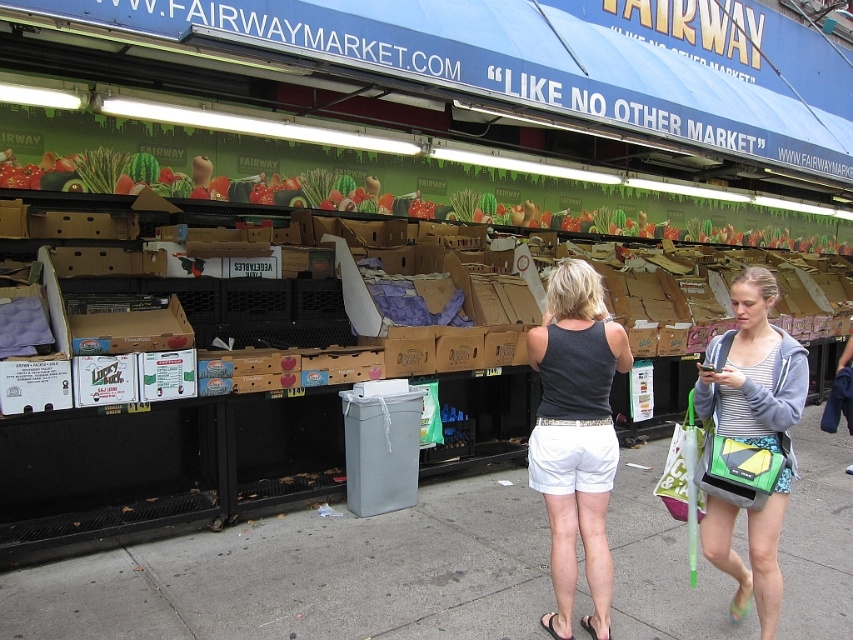
Between point (387, 522) and point (270, 200), which one is positioned in front?

Point (387, 522) is more forward.

Is gray concrete pavement at lower center wider than green leafy vegetables at upper center?

In fact, gray concrete pavement at lower center might be narrower than green leafy vegetables at upper center.

Where is `gray concrete pavement at lower center`? This screenshot has width=853, height=640. gray concrete pavement at lower center is located at coordinates (312, 577).

Looking at this image, is gray concrete pavement at lower center bigger than dark gray tank top at center?

Actually, gray concrete pavement at lower center might be smaller than dark gray tank top at center.

Can you confirm if gray concrete pavement at lower center is shorter than dark gray tank top at center?

Yes.

Between point (326, 628) and point (608, 406), which one is positioned behind?

The point (326, 628) is more distant.

I want to click on gray concrete pavement at lower center, so click(312, 577).

Between point (663, 218) and point (717, 522), which one is positioned behind?

Positioned behind is point (663, 218).

Between point (413, 180) and point (807, 371), which one is positioned in front?

Point (807, 371) is more forward.

This screenshot has width=853, height=640. What are the coordinates of `green leafy vegetables at upper center` in the screenshot? It's located at (405, 189).